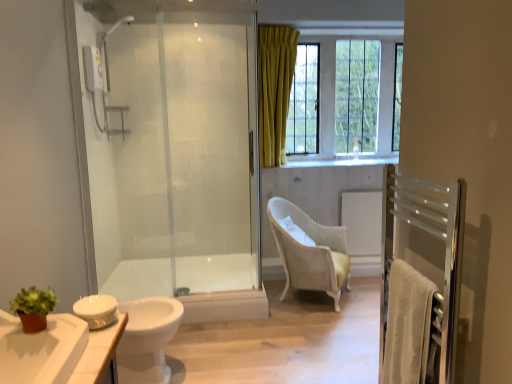
Find the location of a particular element. vacant point above transparent glass shower door at left (from a real-world perspective) is located at coordinates (164, 19).